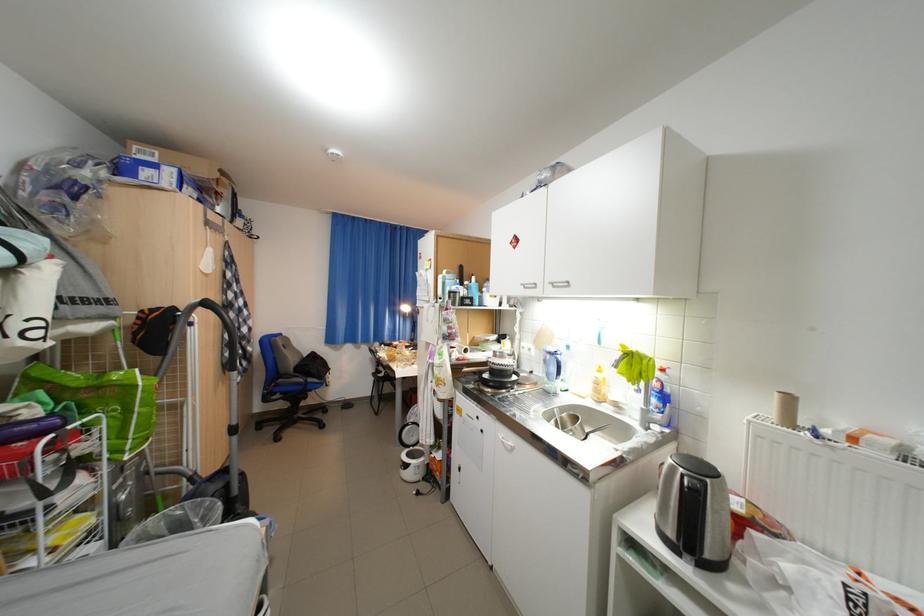
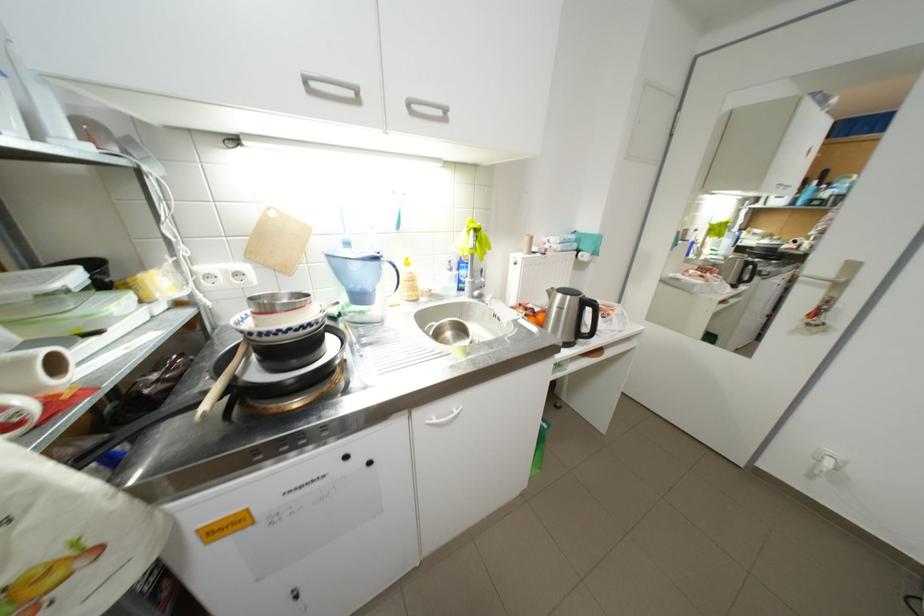
Locate, in the second image, the point that corresponds to (565,355) in the first image.

(387, 259)